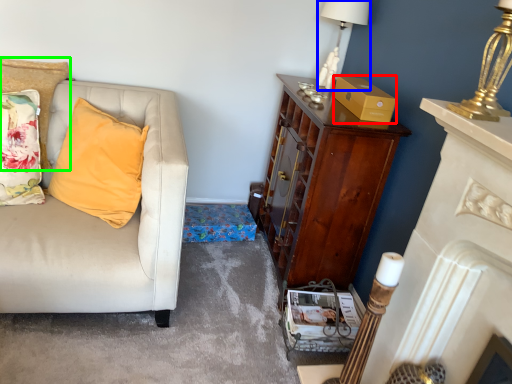
Question: Which object is positioned closest to box (highlighted by a red box)? Select from lamp (highlighted by a blue box) and cushion (highlighted by a green box).

Choices:
 (A) lamp
 (B) cushion

Answer: (A)